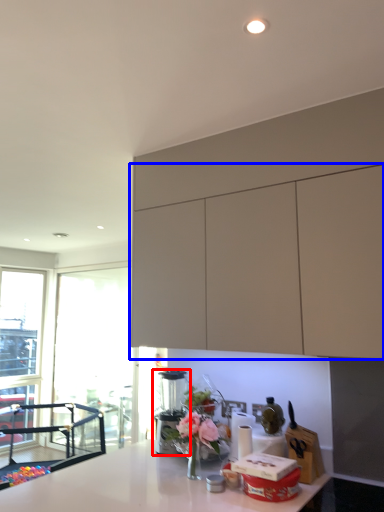
Question: Which point is further to the camera, coffee machine (highlighted by a red box) or cabinetry (highlighted by a blue box)?

Choices:
 (A) coffee machine
 (B) cabinetry

Answer: (A)